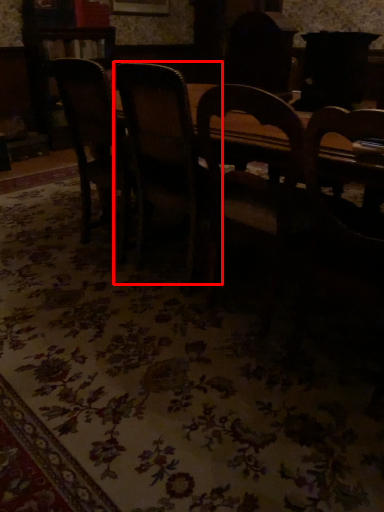
Question: In this image, where is chair (annotated by the red box) located relative to chair?

Choices:
 (A) left
 (B) right

Answer: (B)